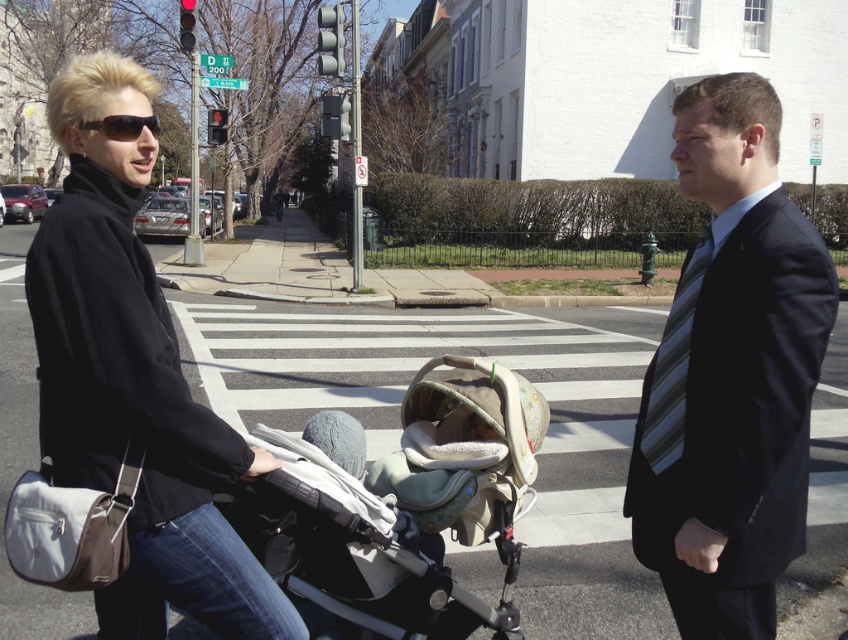
How far apart are striped fabric tie at right and black plastic sunglasses at upper left?

A distance of 5.90 feet exists between striped fabric tie at right and black plastic sunglasses at upper left.

Can you confirm if striped fabric tie at right is bigger than black plastic sunglasses at upper left?

Yes, striped fabric tie at right is bigger than black plastic sunglasses at upper left.

Is point (682, 337) positioned in front of point (106, 131)?

No, (682, 337) is further to viewer.

Where is `striped fabric tie at right`? This screenshot has height=640, width=848. striped fabric tie at right is located at coordinates (673, 365).

Does point (782, 564) come behind point (506, 403)?

No, (782, 564) is closer to viewer.

Between dark blue suit at center and beige fabric baby carriage at center, which one has less height?

With less height is beige fabric baby carriage at center.

Where is `dark blue suit at center`? The image size is (848, 640). dark blue suit at center is located at coordinates (731, 374).

At what (x,y) coordinates should I click in order to perform the action: click on dark blue suit at center. Please return your answer as a coordinate pair (x, y). Looking at the image, I should click on (731, 374).

Can you confirm if dark blue suit at center is smaller than striped fabric tie at right?

No.

Is dark blue suit at center thinner than striped fabric tie at right?

No.

Image resolution: width=848 pixels, height=640 pixels. Describe the element at coordinates (731, 374) in the screenshot. I see `dark blue suit at center` at that location.

The width and height of the screenshot is (848, 640). What are the coordinates of `dark blue suit at center` in the screenshot? It's located at (731, 374).